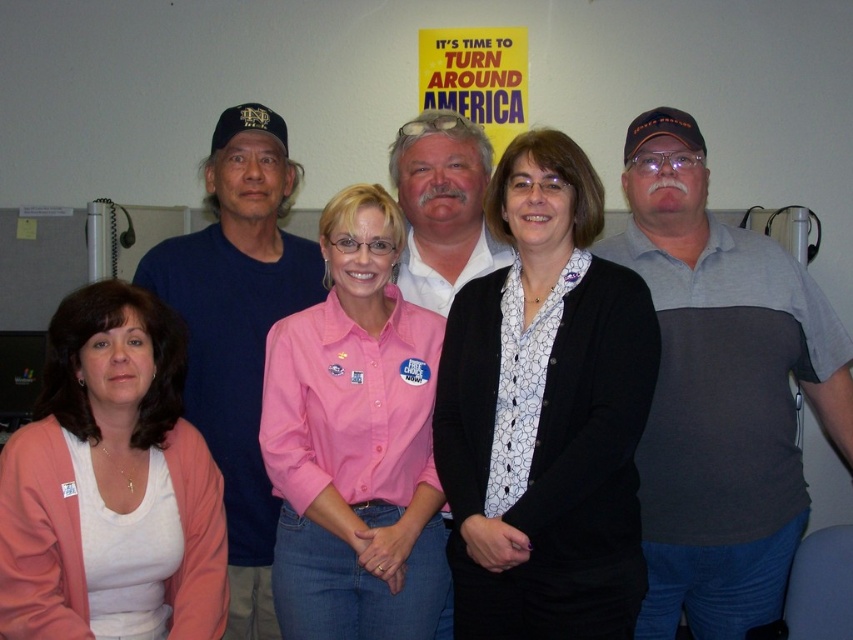
Question: Which point is farther from the camera taking this photo?

Choices:
 (A) (700, 500)
 (B) (210, 353)
 (C) (368, 625)
 (D) (408, 148)

Answer: (D)

Question: Does pink button-down shirt at center appear on the right side of white shirt at center?

Choices:
 (A) yes
 (B) no

Answer: (B)

Question: Which of the following is the closest to the observer?

Choices:
 (A) (57, 308)
 (B) (473, 531)
 (C) (299, 444)

Answer: (B)

Question: Does gray cotton polo shirt at right have a larger size compared to pink fabric shirt at lower left?

Choices:
 (A) yes
 (B) no

Answer: (A)

Question: Which point is closer to the camera?

Choices:
 (A) (521, 374)
 (B) (430, 580)

Answer: (A)

Question: Does dark blue shirt at center appear on the left side of white shirt at center?

Choices:
 (A) yes
 (B) no

Answer: (A)